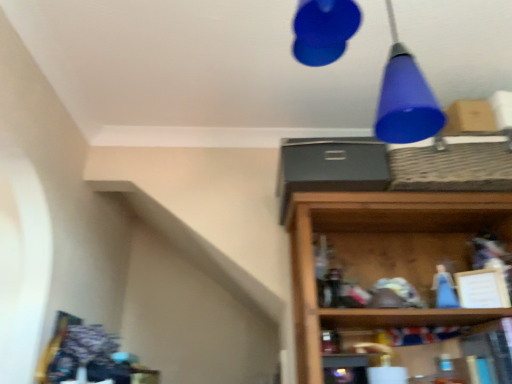
Question: Should I look upward or downward to see matte blue cone at upper right?

Choices:
 (A) down
 (B) up

Answer: (B)